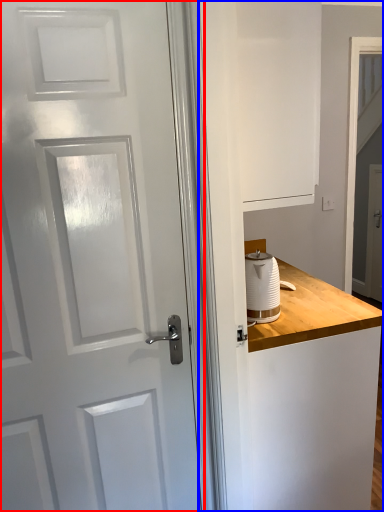
Question: Which object appears closest to the camera in this image, door (highlighted by a red box) or dresser (highlighted by a blue box)?

Choices:
 (A) door
 (B) dresser

Answer: (B)